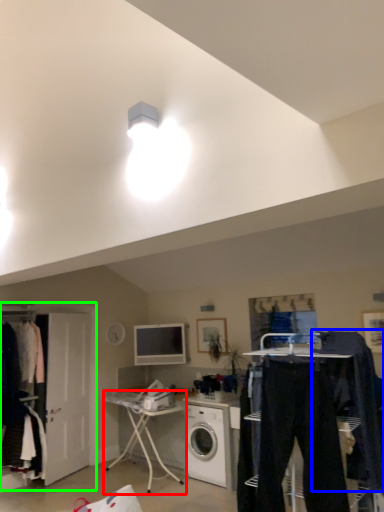
Question: Considering the real-world distances, which object is farthest from desk (highlighted by a red box)? clothing (highlighted by a blue box) or closet (highlighted by a green box)?

Choices:
 (A) clothing
 (B) closet

Answer: (A)